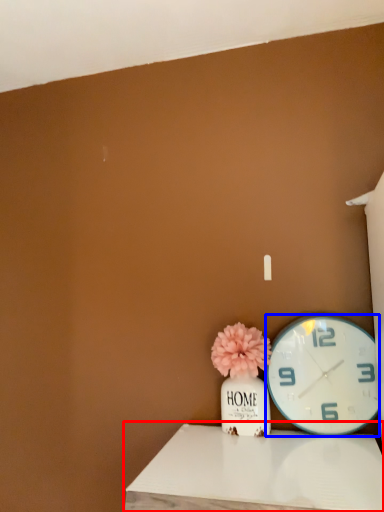
Question: Which object is further to the camera taking this photo, table (highlighted by a red box) or wall clock (highlighted by a blue box)?

Choices:
 (A) table
 (B) wall clock

Answer: (B)